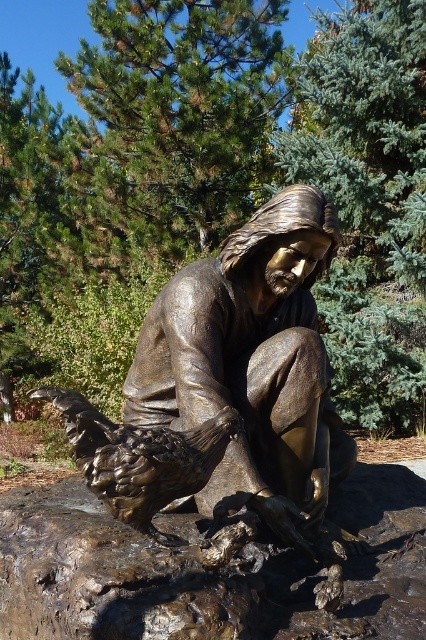
You are an art student observing the bronze statue at center and the rusty metallic rock at center in the image. Which object would appear larger in your view?

The rusty metallic rock at center would appear larger because it is closer to the viewer than the bronze statue at center.

You are a maintenance worker who needs to clean the bronze statue at center and the rusty metallic rock at center. The cleaning equipment you have can only reach objects within 15 inches. Can you clean both objects without moving them?

The distance between the rusty metallic rock at center and the bronze statue at center is 15.01 inches, which is just over the 15 inch limit. Therefore, you cannot clean both objects without moving them as they are slightly too far apart for the equipment to reach both.